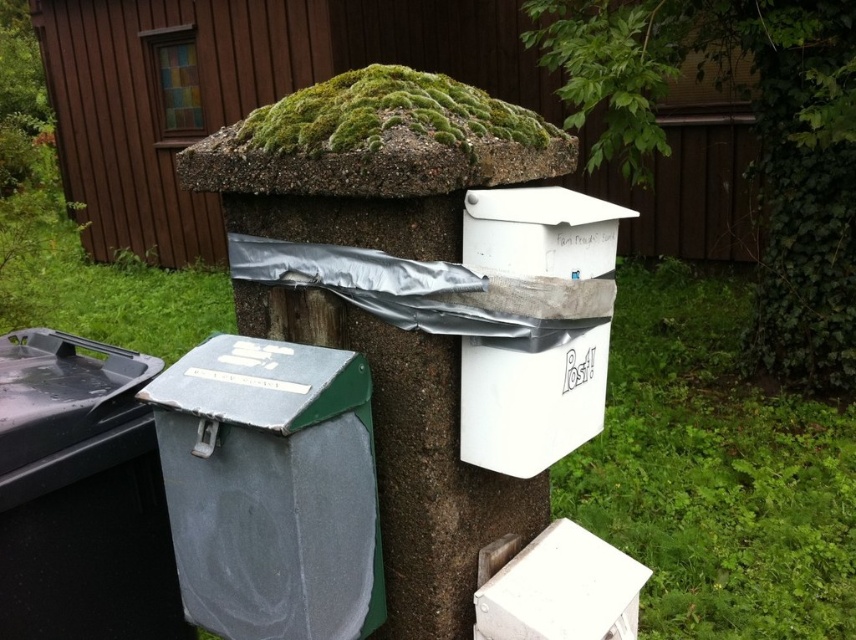
Between point (195, 499) and point (78, 545), which one is positioned in front?

Point (195, 499) is in front.

Is point (185, 432) farther from viewer compared to point (92, 524)?

No.

Locate an element on the screen. The image size is (856, 640). metallic gray recycling bin at lower left is located at coordinates (271, 488).

Which is below, green mossy tree at upper center or metallic gray recycling bin at lower left?

metallic gray recycling bin at lower left is below.

Locate an element on the screen. The width and height of the screenshot is (856, 640). green mossy tree at upper center is located at coordinates (758, 136).

This screenshot has height=640, width=856. What do you see at coordinates (758, 136) in the screenshot? I see `green mossy tree at upper center` at bounding box center [758, 136].

Locate an element on the screen. green mossy tree at upper center is located at coordinates (758, 136).

Does green mossy tree at upper center lie in front of black plastic bin at lower left?

That is False.

The image size is (856, 640). Describe the element at coordinates (758, 136) in the screenshot. I see `green mossy tree at upper center` at that location.

You are a GUI agent. You are given a task and a screenshot of the screen. Output one action in this format:
    pyautogui.click(x=<x>, y=<y>)
    Task: Click on the green mossy tree at upper center
    This screenshot has width=856, height=640.
    Given the screenshot: What is the action you would take?
    pyautogui.click(x=758, y=136)